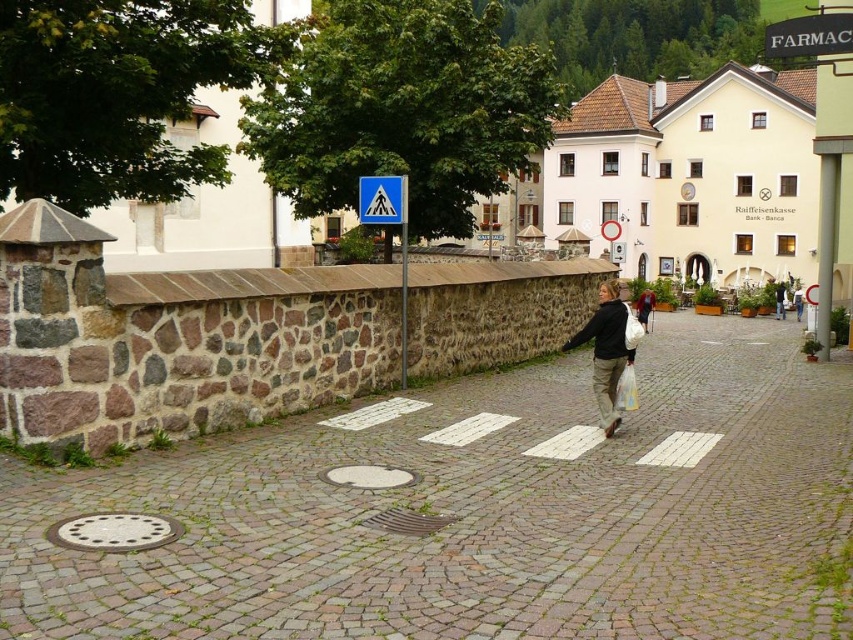
Question: Is matte black jacket at center bigger than black plastic sign at upper right?

Choices:
 (A) yes
 (B) no

Answer: (A)

Question: Which object appears closest to the camera in this image?

Choices:
 (A) blue plastic pedestrian sign at upper center
 (B) metal pedestrian crossing sign at center

Answer: (A)

Question: Does matte black jacket at center have a lesser width compared to black plastic sign at upper right?

Choices:
 (A) no
 (B) yes

Answer: (B)

Question: Estimate the real-world distances between objects in this image. Which object is farther from the blue plastic pedestrian sign at upper center?

Choices:
 (A) matte black jacket at center
 (B) black plastic sign at upper right
 (C) metal pedestrian crossing sign at center

Answer: (B)

Question: Which object appears closest to the camera in this image?

Choices:
 (A) blue plastic pedestrian sign at upper center
 (B) black plastic sign at upper right

Answer: (A)

Question: Is blue plastic pedestrian sign at upper center further to the viewer compared to metal pedestrian crossing sign at center?

Choices:
 (A) no
 (B) yes

Answer: (A)